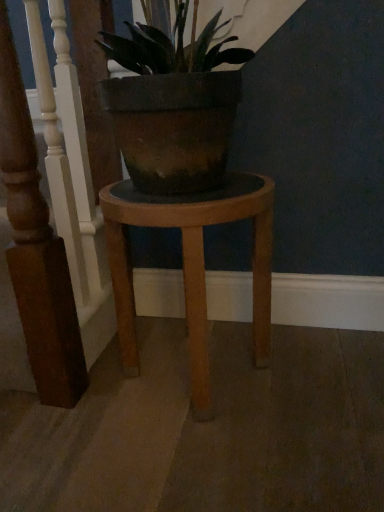
Find the location of a particular element. This screenshot has width=384, height=512. vacant area that is in front of wooden stool at center is located at coordinates (197, 460).